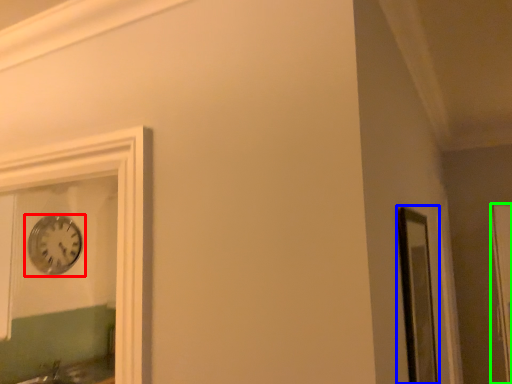
Question: Considering the real-world distances, which object is farthest from wall clock (highlighted by a red box)? window frame (highlighted by a blue box) or glass door (highlighted by a green box)?

Choices:
 (A) window frame
 (B) glass door

Answer: (B)